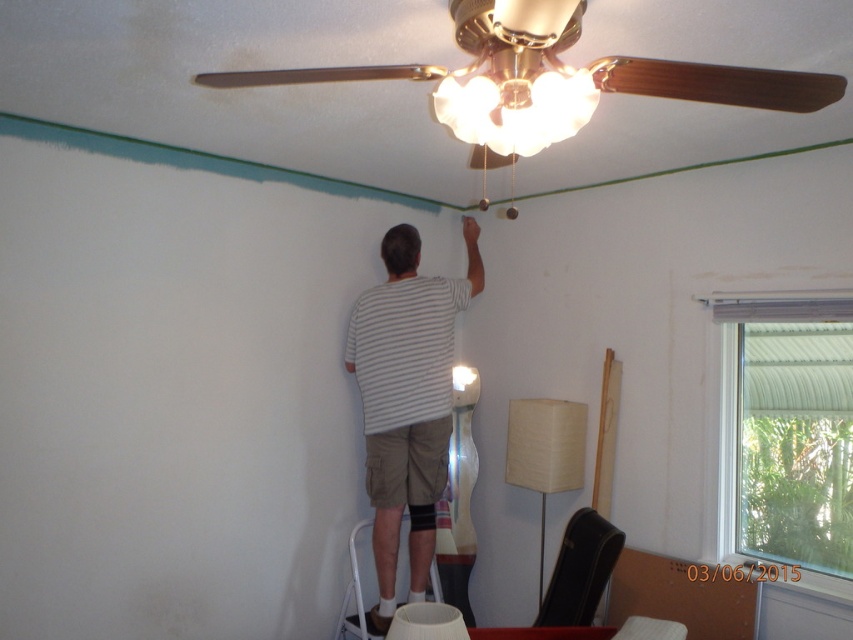
Is striped cotton shirt at upper center positioned in front of matte glass lampshade at center?

Result: No.

Consider the image. Does striped cotton shirt at upper center have a greater height compared to matte glass lampshade at center?

Indeed, striped cotton shirt at upper center has a greater height compared to matte glass lampshade at center.

You are a GUI agent. You are given a task and a screenshot of the screen. Output one action in this format:
    pyautogui.click(x=<x>, y=<y>)
    Task: Click on the striped cotton shirt at upper center
    The height and width of the screenshot is (640, 853).
    Given the screenshot: What is the action you would take?
    pyautogui.click(x=407, y=400)

Between wooden ceiling fan at upper center and beige paper lampshade at lower right, which one has more height?

beige paper lampshade at lower right

Does wooden ceiling fan at upper center have a larger size compared to beige paper lampshade at lower right?

Indeed, wooden ceiling fan at upper center has a larger size compared to beige paper lampshade at lower right.

Is point (460, 83) farther from camera compared to point (543, 506)?

No, it is in front of (543, 506).

The height and width of the screenshot is (640, 853). What are the coordinates of `wooden ceiling fan at upper center` in the screenshot? It's located at (548, 81).

Does beige paper lampshade at lower right have a lesser width compared to white metal ladder at lower center?

In fact, beige paper lampshade at lower right might be wider than white metal ladder at lower center.

Does beige paper lampshade at lower right appear over white metal ladder at lower center?

Indeed, beige paper lampshade at lower right is positioned over white metal ladder at lower center.

What do you see at coordinates (544, 452) in the screenshot? I see `beige paper lampshade at lower right` at bounding box center [544, 452].

Locate an element on the screen. This screenshot has width=853, height=640. beige paper lampshade at lower right is located at coordinates (544, 452).